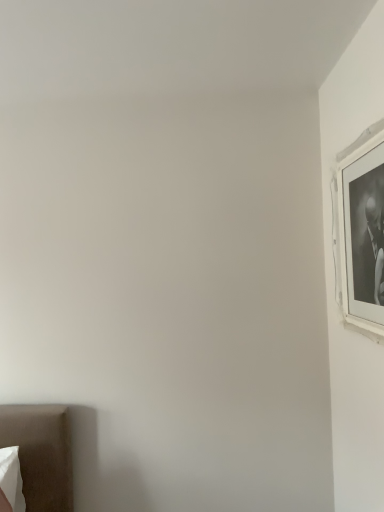
Measure the distance between point (x=350, y=158) and camera.

1.42 meters.

What do you see at coordinates (362, 229) in the screenshot? This screenshot has height=512, width=384. I see `white matte picture frame at upper right` at bounding box center [362, 229].

This screenshot has width=384, height=512. Identify the location of white matte picture frame at upper right. (362, 229).

This screenshot has height=512, width=384. I want to click on white matte picture frame at upper right, so click(362, 229).